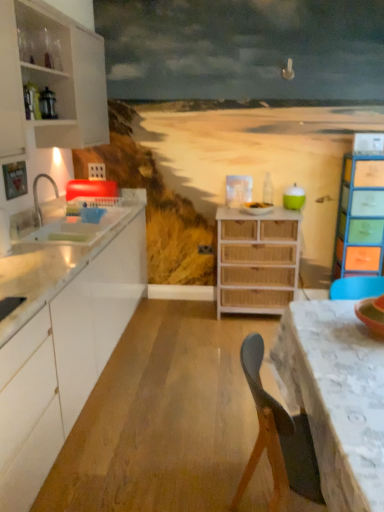
The width and height of the screenshot is (384, 512). What are the coordinates of `empty space that is ontop of woven wood chest of drawers at center, which ranks as the 2th chest of drawers in right-to-left order (from a real-world perspective)` in the screenshot? It's located at (256, 207).